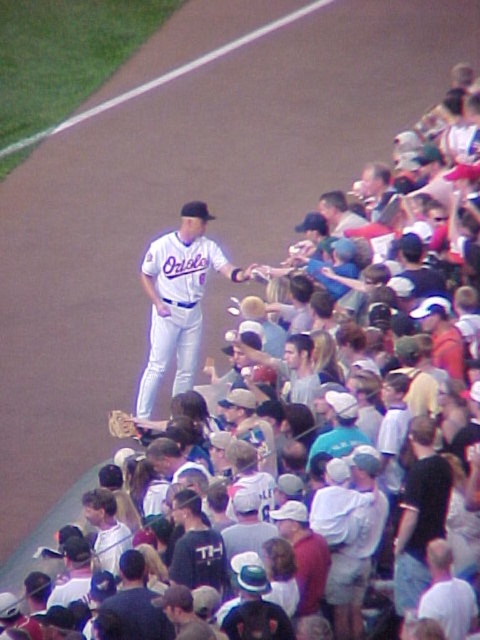
Does black cotton shirt at center appear over brown leather glove at center?

Incorrect, black cotton shirt at center is not positioned above brown leather glove at center.

Is black cotton shirt at center to the left of brown leather glove at center from the viewer's perspective?

No, black cotton shirt at center is not to the left of brown leather glove at center.

Does point (423, 440) come in front of point (134, 435)?

Yes, it is in front of point (134, 435).

The width and height of the screenshot is (480, 640). I want to click on black cotton shirt at center, so click(420, 515).

Consider the image. Who is more distant from viewer, (440, 563) or (109, 428)?

Point (109, 428)

Does white cotton shirt at center have a larger size compared to brown leather glove at center?

Yes.

Which is behind, point (450, 556) or point (110, 419)?

The point (110, 419) is more distant.

Locate an element on the screen. This screenshot has width=480, height=640. white cotton shirt at center is located at coordinates (446, 595).

Between white matte baseball uniform at center and white jersey at center, which one has more height?

white matte baseball uniform at center is taller.

Who is lower down, white matte baseball uniform at center or white jersey at center?

white jersey at center is lower down.

Find the location of a particular element. The image size is (480, 640). white matte baseball uniform at center is located at coordinates (179, 300).